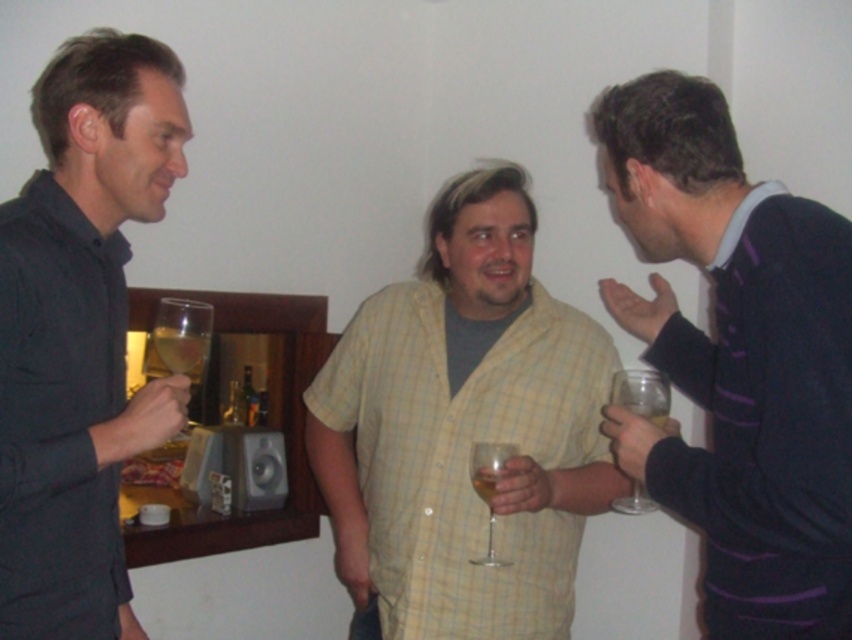
Question: Among these points, which one is farthest from the camera?

Choices:
 (A) (171, 337)
 (B) (652, 372)
 (C) (793, 595)

Answer: (B)

Question: In this image, where is translucent glass wine at left located relative to translucent glass wine at center?

Choices:
 (A) above
 (B) below

Answer: (A)

Question: Among these objects, which one is farthest from the camera?

Choices:
 (A) translucent glass wine glass at center
 (B) clear glass wine glass at left
 (C) translucent glass wine at left

Answer: (A)

Question: Which point is closer to the camera?

Choices:
 (A) clear glass wine glass at center
 (B) yellow checkered shirt at center
 (C) clear glass wine glass at left

Answer: (A)

Question: Is clear glass wine glass at left further to the viewer compared to translucent glass wine at left?

Choices:
 (A) yes
 (B) no

Answer: (B)

Question: Does yellow checkered shirt at center have a smaller size compared to clear glass wine glass at center?

Choices:
 (A) no
 (B) yes

Answer: (A)